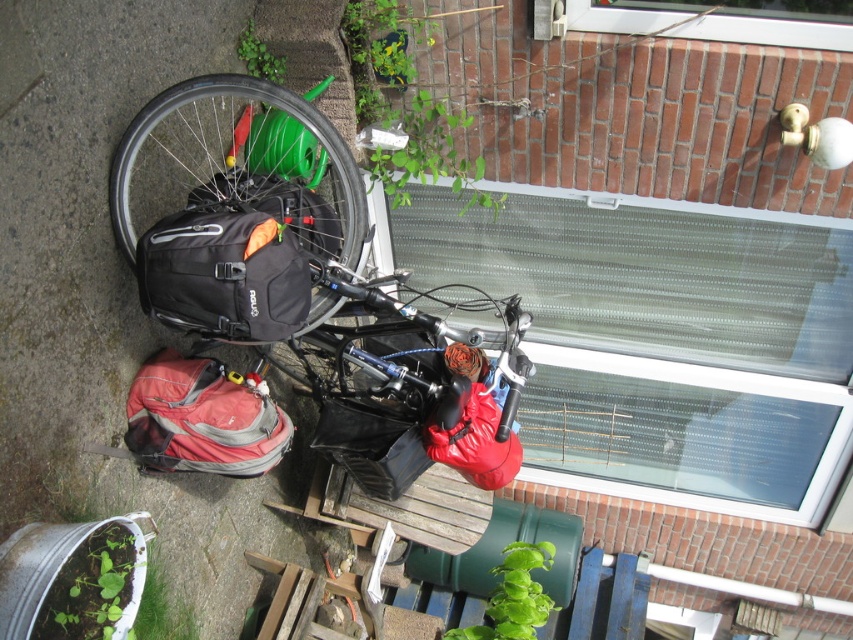
You are standing in front of the brick building and want to pick up both the matte black backpack at center and the matte red bag at center. Which one should you reach for first based on their positions?

The matte black backpack at center is closer to you than the matte red bag at center, so you should reach for the matte black backpack at center first.